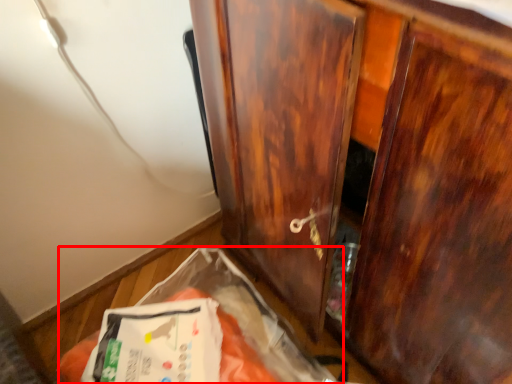
Question: Considering the relative positions of waste (annotated by the red box) and cupboard in the image provided, where is waste (annotated by the red box) located with respect to the staircase?

Choices:
 (A) right
 (B) left

Answer: (B)